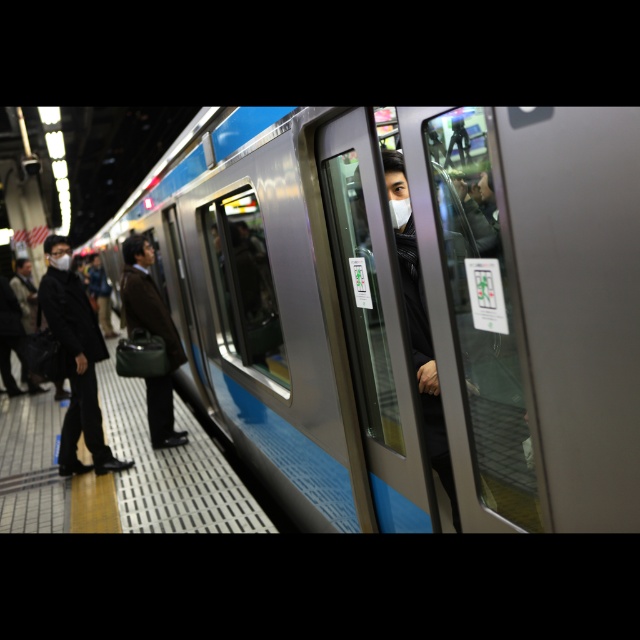
Based on the photo, does metallic silver train at center have a lesser height compared to black matte suit at left?

Yes.

Is metallic silver train at center thinner than black matte suit at left?

No.

Describe the element at coordinates (410, 304) in the screenshot. The image size is (640, 640). I see `metallic silver train at center` at that location.

Find the location of `metallic silver train at center`. metallic silver train at center is located at coordinates (410, 304).

Measure the distance between metallic silver train at center and matte brown coat at center.

8.30 feet

Is metallic silver train at center behind matte brown coat at center?

No.

I want to click on metallic silver train at center, so click(410, 304).

Between point (93, 348) and point (176, 337), which one is positioned in front?

Positioned in front is point (93, 348).

Between point (96, 380) and point (132, 240), which one is positioned behind?

The point (132, 240) is behind.

This screenshot has height=640, width=640. What do you see at coordinates (76, 358) in the screenshot?
I see `black matte suit at left` at bounding box center [76, 358].

Locate an element on the screen. The height and width of the screenshot is (640, 640). black matte suit at left is located at coordinates (76, 358).